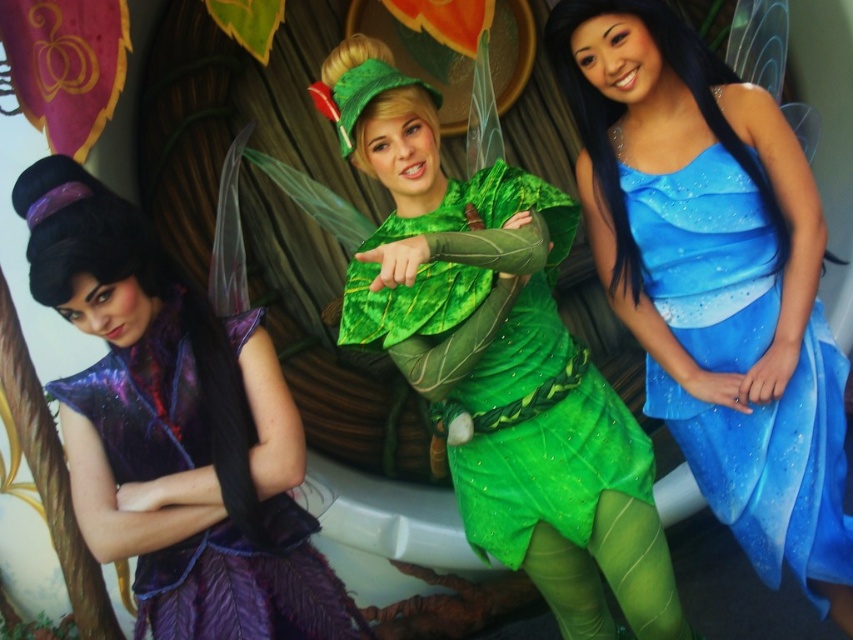
You are a photographer at the event and need to capture both the blue satin dress at center and the green leafy costume at center in a single frame. Based on their positions, which one should you focus on first to ensure both are in the frame?

The blue satin dress at center is positioned under the green leafy costume at center, so focusing on the green leafy costume at center first would allow the blue satin dress at center to be captured below it in the frame.

You are a photographer standing at the center of the scene. You want to take a photo of both the blue satin dress at center and the green leafy costume at center. How far apart are these two costumes from each other?

The blue satin dress at center is 7.71 meters from the green leafy costume at center, so they are 7.71 meters apart.